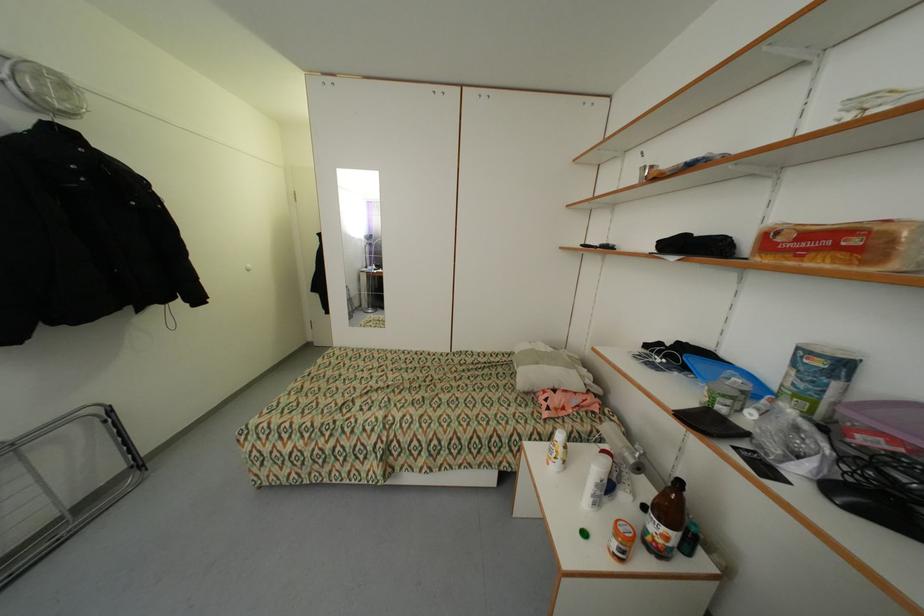
I want to click on metal cup, so click(633, 459).